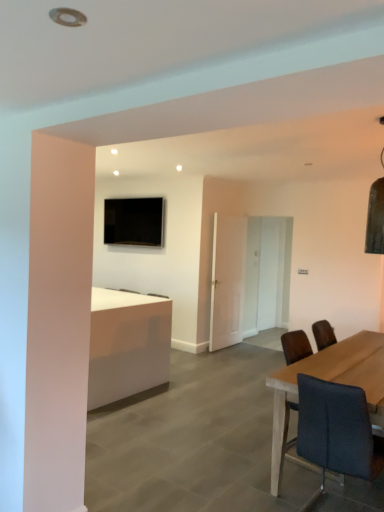
Question: Can you confirm if white glossy door at center, which ranks as the second glass door in left-to-right order, is positioned to the left of black glossy tv at upper center?

Choices:
 (A) yes
 (B) no

Answer: (B)

Question: Considering the relative sizes of white glossy door at center, which ranks as the second glass door in left-to-right order, and black glossy tv at upper center in the image provided, is white glossy door at center, which ranks as the second glass door in left-to-right order, bigger than black glossy tv at upper center?

Choices:
 (A) no
 (B) yes

Answer: (B)

Question: Considering the relative sizes of white glossy door at center, which ranks as the second glass door in left-to-right order, and black glossy tv at upper center in the image provided, is white glossy door at center, which ranks as the second glass door in left-to-right order, thinner than black glossy tv at upper center?

Choices:
 (A) no
 (B) yes

Answer: (A)

Question: Can you see white glossy door at center, the 1th glass door in the right-to-left sequence, touching black glossy tv at upper center?

Choices:
 (A) yes
 (B) no

Answer: (B)

Question: Can we say white glossy door at center, which ranks as the second glass door in left-to-right order, lies outside black glossy tv at upper center?

Choices:
 (A) no
 (B) yes

Answer: (B)

Question: Looking at their shapes, would you say white glossy door at center, the 1th glass door in the right-to-left sequence, is wider or thinner than white glossy desk at center?

Choices:
 (A) thin
 (B) wide

Answer: (A)

Question: From the image's perspective, relative to white glossy desk at center, is white glossy door at center, which ranks as the second glass door in left-to-right order, above or below?

Choices:
 (A) below
 (B) above

Answer: (B)

Question: Considering their positions, is white glossy door at center, the 1th glass door in the right-to-left sequence, located in front of or behind white glossy desk at center?

Choices:
 (A) behind
 (B) front

Answer: (A)

Question: Considering the positions of white glossy door at center, the 1th glass door in the right-to-left sequence, and white glossy desk at center in the image, is white glossy door at center, the 1th glass door in the right-to-left sequence, bigger or smaller than white glossy desk at center?

Choices:
 (A) big
 (B) small

Answer: (B)

Question: From a real-world perspective, is white glossy door at center, the 1th glass door in the right-to-left sequence, positioned above or below black glossy tv at upper center?

Choices:
 (A) above
 (B) below

Answer: (B)

Question: In terms of width, does white glossy door at center, which ranks as the second glass door in left-to-right order, look wider or thinner when compared to black glossy tv at upper center?

Choices:
 (A) wide
 (B) thin

Answer: (A)

Question: Considering the positions of white glossy door at center, the 1th glass door in the right-to-left sequence, and black glossy tv at upper center in the image, is white glossy door at center, the 1th glass door in the right-to-left sequence, bigger or smaller than black glossy tv at upper center?

Choices:
 (A) small
 (B) big

Answer: (B)

Question: Which is correct: white glossy door at center, the 1th glass door in the right-to-left sequence, is inside black glossy tv at upper center, or outside of it?

Choices:
 (A) inside
 (B) outside

Answer: (B)

Question: Is white glossy door at center, which ranks as the second glass door in left-to-right order, situated inside dark gray fabric chair at right or outside?

Choices:
 (A) outside
 (B) inside

Answer: (A)

Question: From their relative heights in the image, would you say white glossy door at center, which ranks as the second glass door in left-to-right order, is taller or shorter than dark gray fabric chair at right?

Choices:
 (A) tall
 (B) short

Answer: (A)